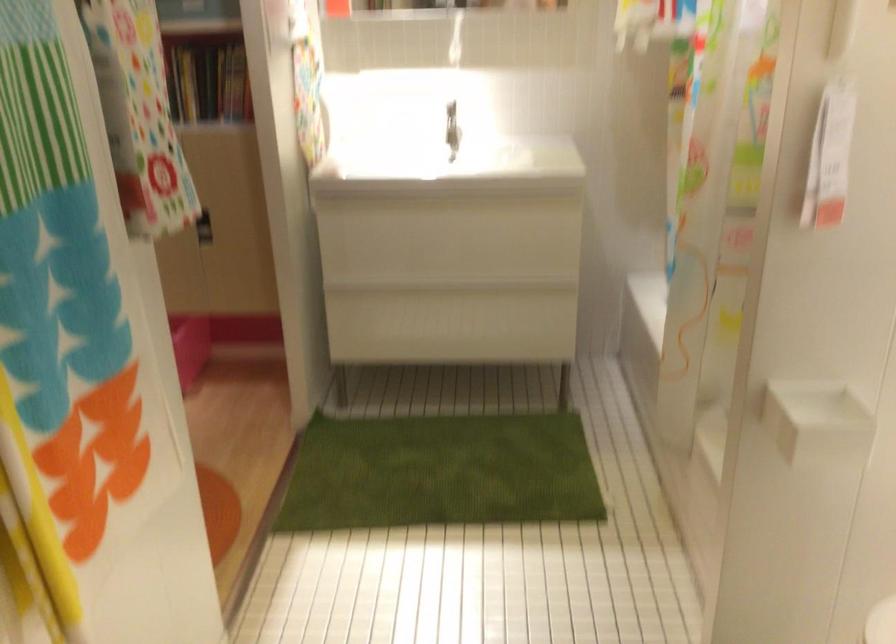
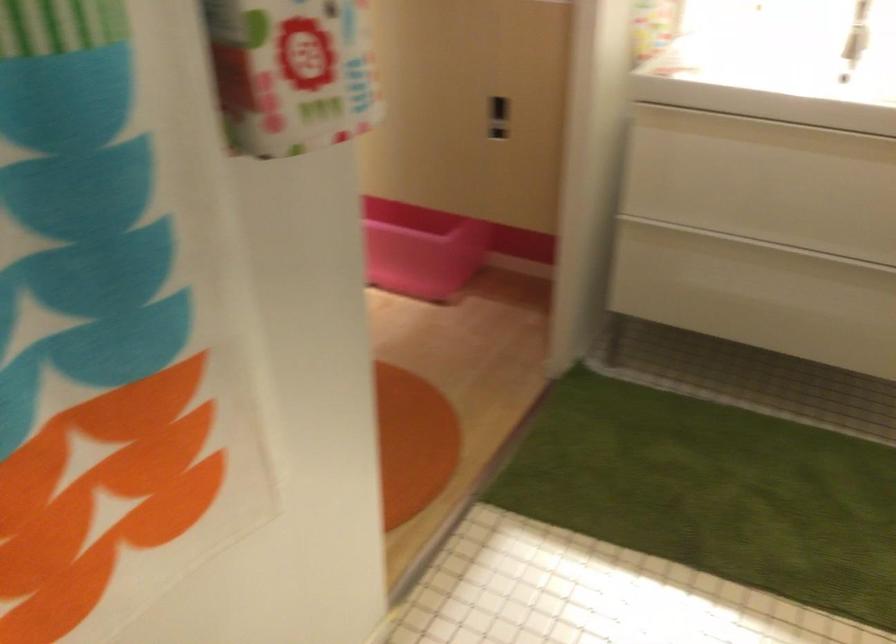
In the second image, find the point that corresponds to pixel 410 301 in the first image.

(734, 254)